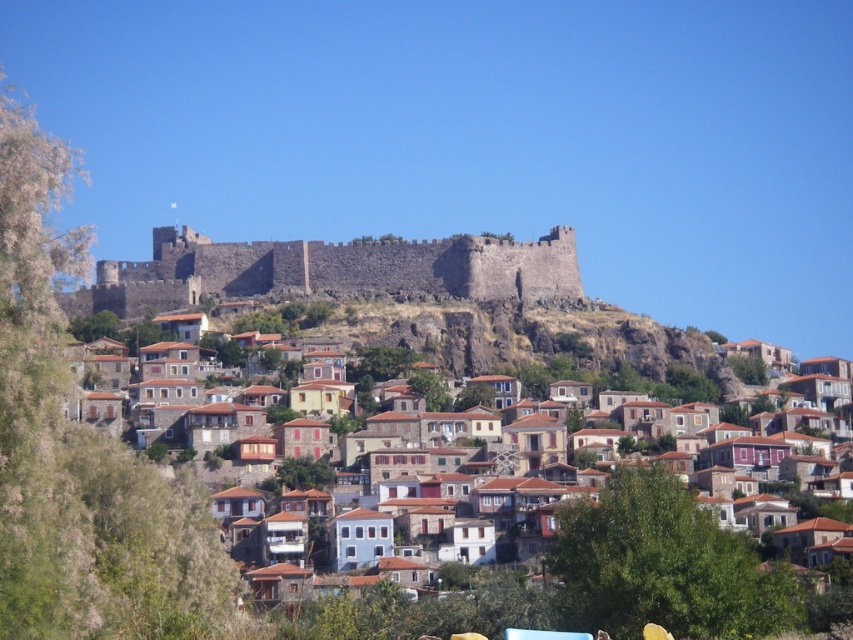
Question: Among these points, which one is nearest to the camera?

Choices:
 (A) (473, 346)
 (B) (204, 284)

Answer: (A)

Question: In this image, where is brown stone houses at center located relative to dark stone wall at upper center?

Choices:
 (A) above
 (B) below

Answer: (B)

Question: Is brown stone houses at center thinner than dark stone wall at upper center?

Choices:
 (A) no
 (B) yes

Answer: (A)

Question: Does brown stone houses at center appear under dark stone wall at upper center?

Choices:
 (A) no
 (B) yes

Answer: (B)